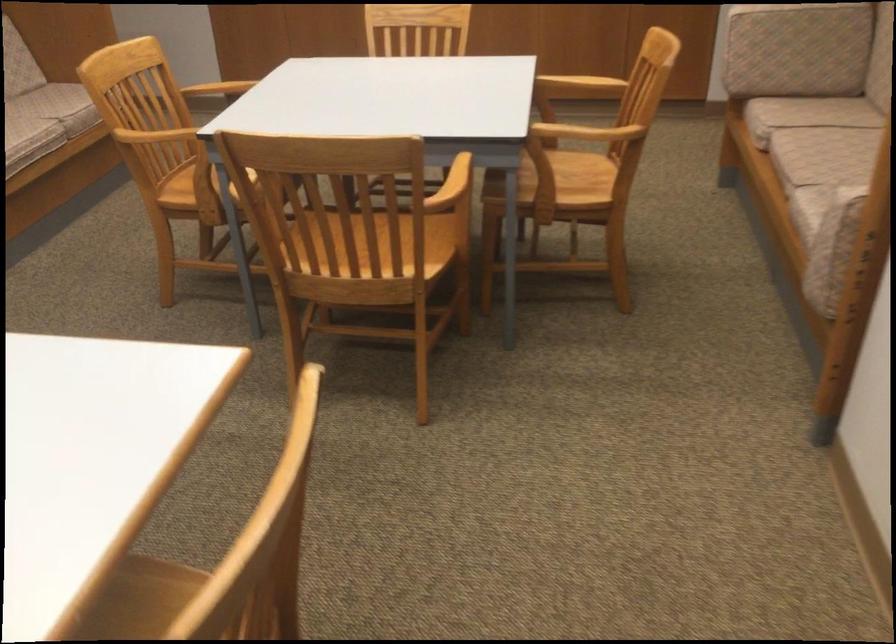
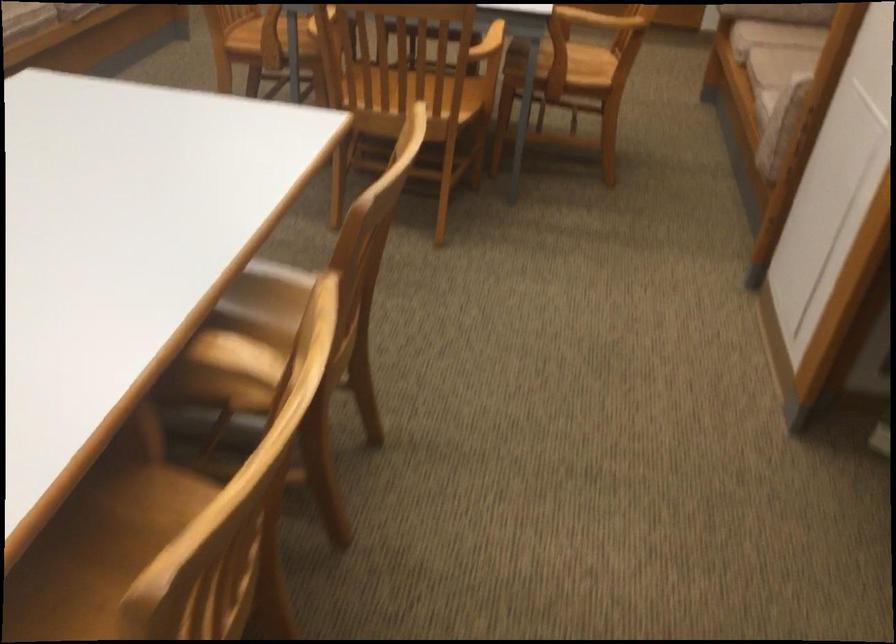
Question: I am providing you with two images of the same scene from different viewpoints. After the viewpoint changes to image2, which objects are now occluded?

Choices:
 (A) wooden chair armrest
 (B) sofa armrest
 (C) blue handheld calculator
 (D) sofa sitting surface

Answer: (B)